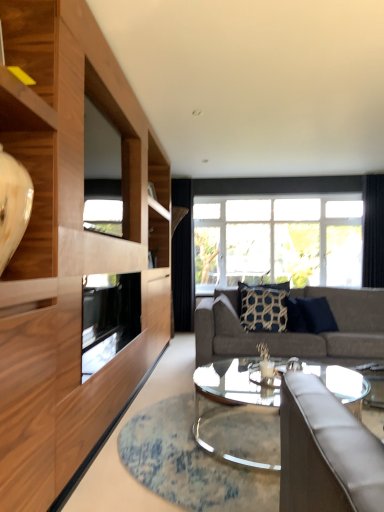
Find the location of `dark blue textured pillow at center, acting as the first pillow starting from the right`. dark blue textured pillow at center, acting as the first pillow starting from the right is located at coordinates (317, 315).

What do you see at coordinates (68, 248) in the screenshot? I see `wooden cabinet at left` at bounding box center [68, 248].

What is the approximate width of shiny white vase at left?

8.23 inches.

Where is `shiny white vase at left`? Image resolution: width=384 pixels, height=512 pixels. shiny white vase at left is located at coordinates (32, 175).

Identify the location of gray fabric couch at center. (294, 333).

Considering the sizes of navy blue textured pillow at center, the first pillow when ordered from left to right, and clear glass coffee table at center in the image, is navy blue textured pillow at center, the first pillow when ordered from left to right, taller or shorter than clear glass coffee table at center?

Considering their sizes, navy blue textured pillow at center, the first pillow when ordered from left to right, has more height than clear glass coffee table at center.

Which is in front, navy blue textured pillow at center, which is counted as the second pillow, starting from the right, or clear glass coffee table at center?

clear glass coffee table at center is closer to the camera.

Is navy blue textured pillow at center, the first pillow when ordered from left to right, smaller than clear glass coffee table at center?

Correct, navy blue textured pillow at center, the first pillow when ordered from left to right, occupies less space than clear glass coffee table at center.

Does navy blue textured pillow at center, the first pillow when ordered from left to right, appear on the left side of clear glass coffee table at center?

Incorrect, navy blue textured pillow at center, the first pillow when ordered from left to right, is not on the left side of clear glass coffee table at center.

Between transparent glass window screen at upper left and clear glass window at center, which one has larger width?

clear glass window at center.

Based on their sizes in the image, would you say transparent glass window screen at upper left is bigger or smaller than clear glass window at center?

transparent glass window screen at upper left is smaller than clear glass window at center.

Is transparent glass window screen at upper left surrounding clear glass window at center?

Actually, clear glass window at center is outside transparent glass window screen at upper left.

In order to click on window screen that appears in front of the clear glass window at center in this screenshot , I will do `click(102, 174)`.

From the image's perspective, which object appears higher, shiny white vase at left or transparent glass window screen at upper left?

transparent glass window screen at upper left appears higher in the image.

Looking at this image, is transparent glass window screen at upper left at the back of shiny white vase at left?

No, shiny white vase at left is not facing the opposite direction of transparent glass window screen at upper left.

In the image, is shiny white vase at left on the left side or the right side of transparent glass window screen at upper left?

From the image, it's evident that shiny white vase at left is to the left of transparent glass window screen at upper left.

Does shiny white vase at left have a larger size compared to transparent glass window screen at upper left?

Actually, shiny white vase at left might be smaller than transparent glass window screen at upper left.

Consider the image. Which is correct: black fabric curtain at right is inside gray fabric couch at center, or outside of it?

The correct answer is: outside.

Does black fabric curtain at right touch gray fabric couch at center?

No, black fabric curtain at right is not next to gray fabric couch at center.

Who is bigger, black fabric curtain at right or gray fabric couch at center?

Bigger between the two is gray fabric couch at center.

Is navy blue textured pillow at center, the first pillow when ordered from left to right, completely or partially inside transparent glass window screen at upper left?

No, transparent glass window screen at upper left does not contain navy blue textured pillow at center, the first pillow when ordered from left to right.

Based on the photo, which point is more forward, (101, 211) or (254, 314)?

Positioned in front is point (101, 211).

From a real-world perspective, does transparent glass window screen at upper left stand above navy blue textured pillow at center, the first pillow when ordered from left to right?

Indeed, from a real-world perspective, transparent glass window screen at upper left stands above navy blue textured pillow at center, the first pillow when ordered from left to right.

What's the angular difference between transparent glass window screen at upper left and navy blue textured pillow at center, which is counted as the second pillow, starting from the right,'s facing directions?

The angular difference between transparent glass window screen at upper left and navy blue textured pillow at center, which is counted as the second pillow, starting from the right, is 88.4 degrees.

Does shiny white vase at left have a smaller size compared to gray fabric couch at center?

Yes, shiny white vase at left is smaller than gray fabric couch at center.

Which of these two, shiny white vase at left or gray fabric couch at center, stands taller?

gray fabric couch at center.

Is shiny white vase at left further to the viewer compared to gray fabric couch at center?

No, the depth of shiny white vase at left is less than that of gray fabric couch at center.

Is dark blue textured pillow at center, acting as the first pillow starting from the right, facing away from transparent glass window screen at upper left?

No, transparent glass window screen at upper left is not at the back of dark blue textured pillow at center, acting as the first pillow starting from the right.

Which of these two, dark blue textured pillow at center, positioned as the 2th pillow in left-to-right order, or transparent glass window screen at upper left, is smaller?

dark blue textured pillow at center, positioned as the 2th pillow in left-to-right order, is smaller.

Is point (324, 308) closer or farther from the camera than point (92, 139)?

Clearly, point (324, 308) is more distant from the camera than point (92, 139).

Is dark blue textured pillow at center, acting as the first pillow starting from the right, thinner than transparent glass window screen at upper left?

Incorrect, the width of dark blue textured pillow at center, acting as the first pillow starting from the right, is not less than that of transparent glass window screen at upper left.

Locate an element on the screen. This screenshot has width=384, height=512. coffee table below the navy blue textured pillow at center, which is counted as the second pillow, starting from the right (from the image's perspective) is located at coordinates (238, 412).

Image resolution: width=384 pixels, height=512 pixels. I want to click on window below the transparent glass window screen at upper left (from a real-world perspective), so click(x=276, y=186).

Based on their spatial positions, is wooden cabinet at left or gray fabric couch at center closer to navy blue textured pillow at center, which is counted as the second pillow, starting from the right?

gray fabric couch at center lies closer to navy blue textured pillow at center, which is counted as the second pillow, starting from the right, than the other object.

Which object lies nearer to the anchor point gray fabric couch at center, black fabric curtain at right or dark blue textured pillow at center, acting as the first pillow starting from the right?

dark blue textured pillow at center, acting as the first pillow starting from the right.

Estimate the real-world distances between objects in this image. Which object is further from clear glass window at center, black fabric curtain at right or shiny white vase at left?

shiny white vase at left lies further to clear glass window at center than the other object.

Looking at the image, which one is located closer to gray fabric couch at center, black fabric curtain at right or clear glass window at center?

Among the two, clear glass window at center is located nearer to gray fabric couch at center.

Estimate the real-world distances between objects in this image. Which object is further from navy blue textured pillow at center, the first pillow when ordered from left to right, black fabric curtain at right or wooden cabinet at left?

black fabric curtain at right is further to navy blue textured pillow at center, the first pillow when ordered from left to right.

Estimate the real-world distances between objects in this image. Which object is further from shiny white vase at left, clear glass window at center or gray fabric couch at center?

clear glass window at center.

Considering their positions, is dark blue textured pillow at center, positioned as the 2th pillow in left-to-right order, positioned closer to wooden cabinet at left than black fabric curtain at right?

The object closer to wooden cabinet at left is dark blue textured pillow at center, positioned as the 2th pillow in left-to-right order.

Consider the image. Based on their spatial positions, is transparent glass window screen at upper left or navy blue textured pillow at center, the first pillow when ordered from left to right, further from gray fabric couch at center?

Among the two, transparent glass window screen at upper left is located further to gray fabric couch at center.

I want to click on studio couch between transparent glass window screen at upper left and black fabric curtain at right along the z-axis, so click(x=294, y=333).

Locate an element on the screen. This screenshot has width=384, height=512. curtain positioned between navy blue textured pillow at center, which is counted as the second pillow, starting from the right, and clear glass window at center from near to far is located at coordinates (373, 231).

You are a GUI agent. You are given a task and a screenshot of the screen. Output one action in this format:
    pyautogui.click(x=<x>, y=<y>)
    Task: Click on the shelf located between wooden cabinet at left and navy blue textured pillow at center, the first pillow when ordered from left to right, in the depth direction
    This screenshot has width=384, height=512.
    Given the screenshot: What is the action you would take?
    pyautogui.click(x=32, y=175)

This screenshot has width=384, height=512. In order to click on coffee table positioned between shiny white vase at left and navy blue textured pillow at center, which is counted as the second pillow, starting from the right, from near to far in this screenshot , I will do `click(238, 412)`.